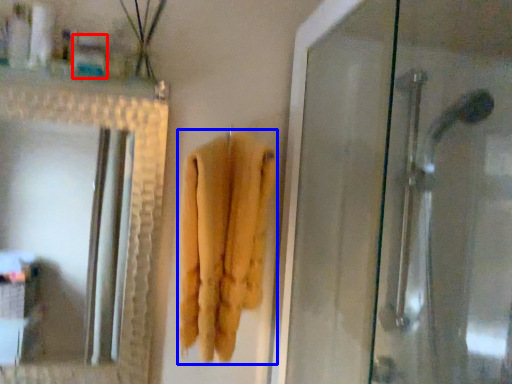
Question: Among these objects, which one is nearest to the camera, toiletry (highlighted by a red box) or towel (highlighted by a blue box)?

Choices:
 (A) toiletry
 (B) towel

Answer: (B)